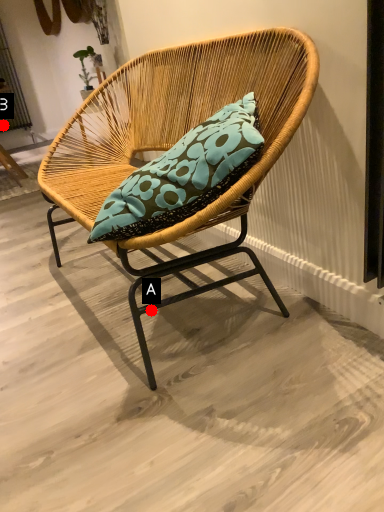
Question: Two points are circled on the image, labeled by A and B beside each circle. Among these points, which one is farthest from the camera?

Choices:
 (A) A is further
 (B) B is further

Answer: (B)